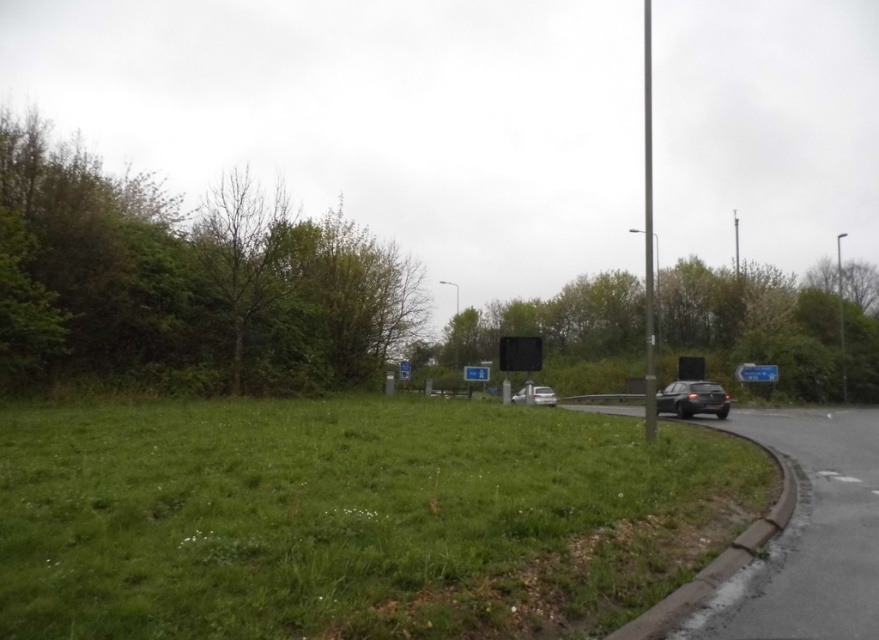
You are a pedestrian standing on the grassy area with scattered white flowers. You see a smooth gray pole at right and a blue plastic sign at right. Which object is taller?

The smooth gray pole at right is taller than the blue plastic sign at right.

You are a pedestrian standing on the grassy area with scattered white flowers. You see a white glossy car at center and a metallic reflective sign at center. Which object is closer to you?

The white glossy car at center is closer to you because it is located below the metallic reflective sign at center, indicating it is positioned lower in the image and thus nearer to the observer.

You are standing at the center of the road and want to reach the green leafy tree at left. Which direction should you walk?

The green leafy tree at left is located at point (187, 280), so you should walk towards the left direction to reach it.